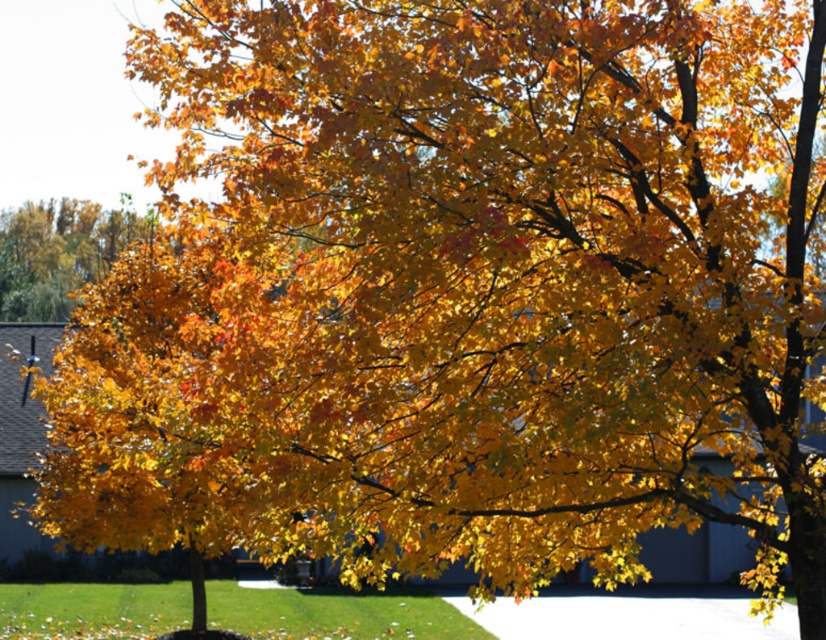
Question: In this image, where is white concrete pavement at lower center located relative to golden yellow leaves at upper left?

Choices:
 (A) above
 (B) below

Answer: (B)

Question: From the image, what is the correct spatial relationship of white concrete pavement at lower center in relation to golden yellow leaves at upper left?

Choices:
 (A) right
 (B) left

Answer: (A)

Question: Observing the image, what is the correct spatial positioning of white concrete pavement at lower center in reference to golden yellow leaves at upper left?

Choices:
 (A) below
 (B) above

Answer: (A)